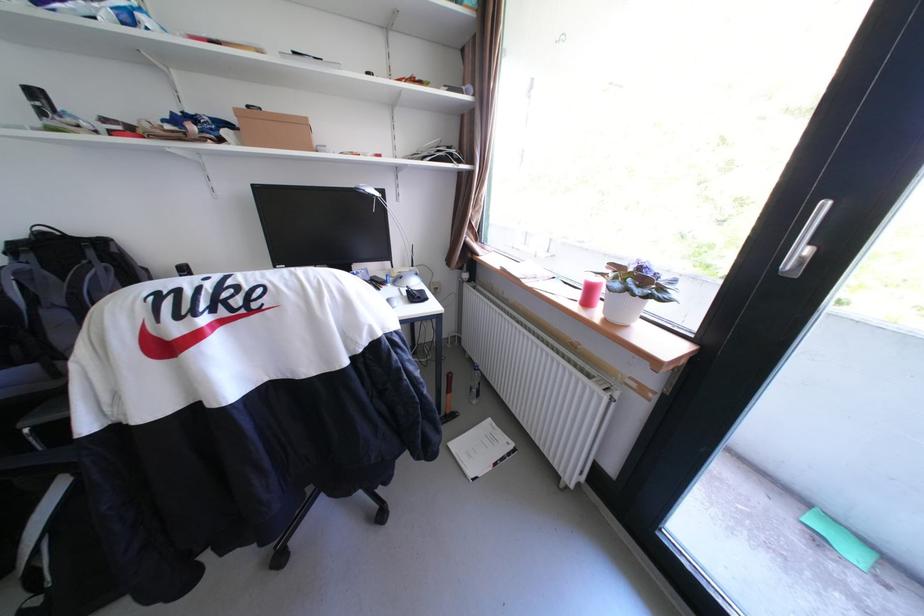
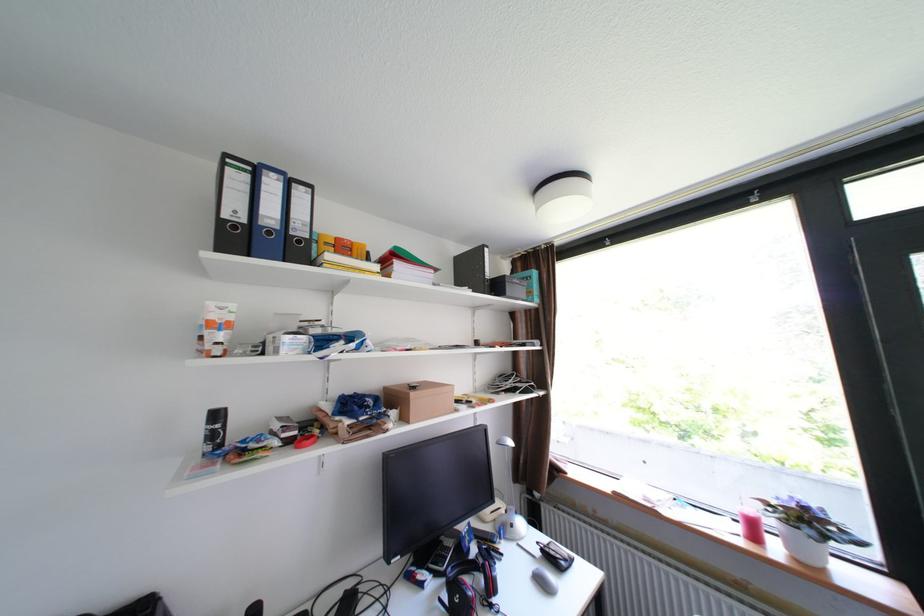
Locate, in the second image, the point that corresponds to point 589,294 in the first image.

(749, 530)